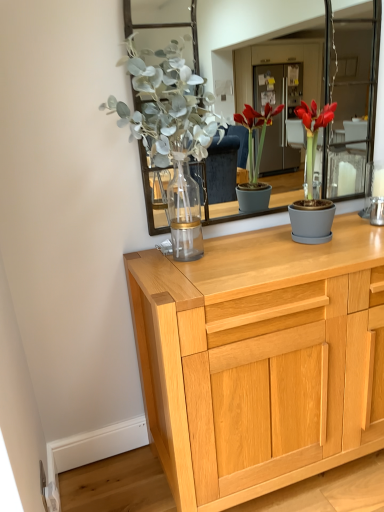
The image size is (384, 512). Identify the location of vacant region to the left of matte gray pot at center. (271, 246).